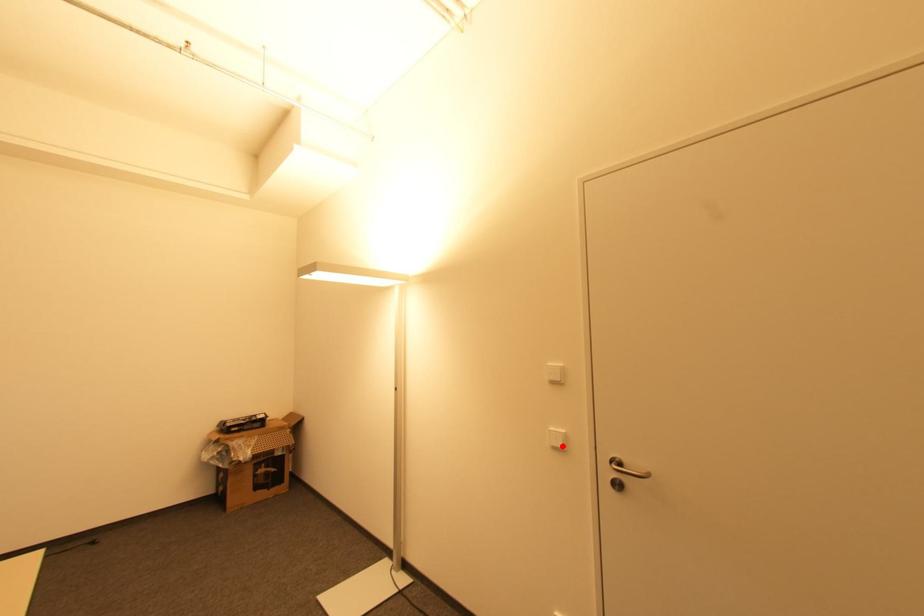
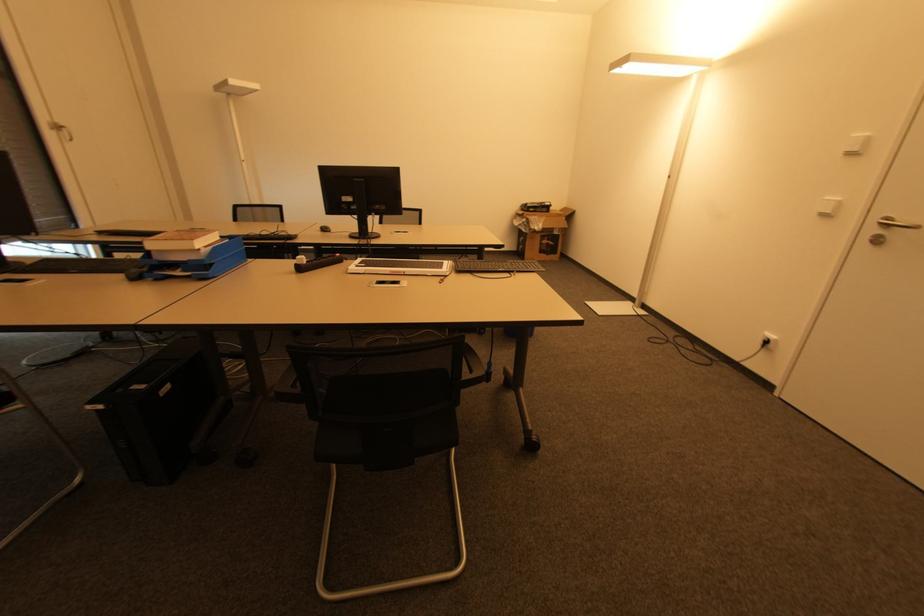
Locate, in the second image, the point that corresponds to the highlighted location in the first image.

(832, 214)